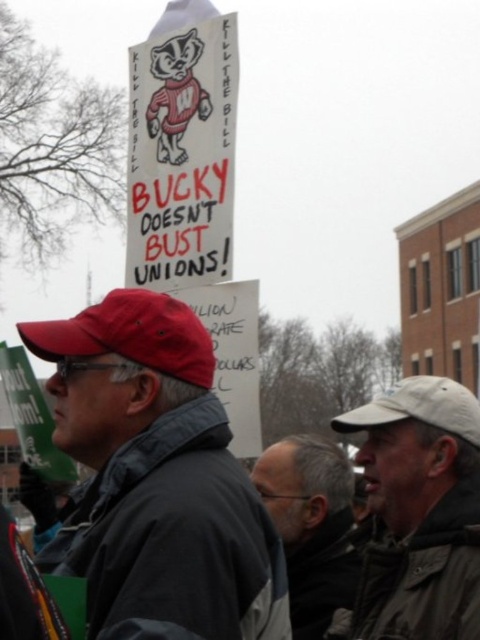
Question: Is red fabric cap at left to the right of white fabric baseball cap at upper right from the viewer's perspective?

Choices:
 (A) yes
 (B) no

Answer: (B)

Question: Which point is farther from the camera taking this photo?

Choices:
 (A) (305, 470)
 (B) (450, 477)

Answer: (A)

Question: Which point is farther from the camera taking this photo?

Choices:
 (A) (392, 388)
 (B) (435, 424)

Answer: (A)

Question: Which object is positioned closest to the white fabric cap at upper right?

Choices:
 (A) gray fabric jacket at lower center
 (B) white fabric baseball cap at upper right

Answer: (A)

Question: Does red fabric cap at left appear over white fabric baseball cap at upper right?

Choices:
 (A) no
 (B) yes

Answer: (B)

Question: Does matte red baseball cap at center have a lesser width compared to white fabric baseball cap at upper right?

Choices:
 (A) yes
 (B) no

Answer: (A)